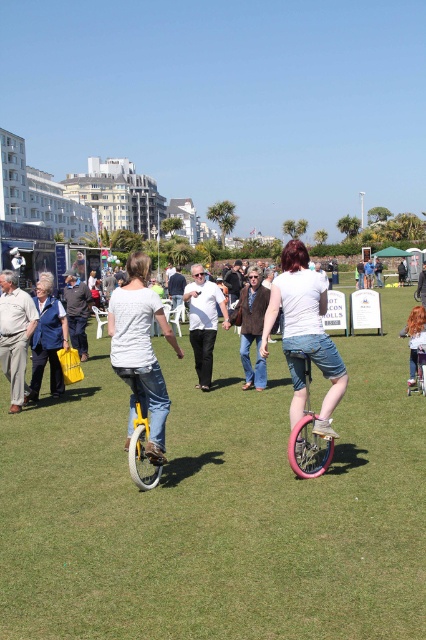
Question: Can you confirm if white matte unicycle at center is thinner than light brown fabric pants at left?

Choices:
 (A) no
 (B) yes

Answer: (A)

Question: Considering the real-world distances, which object is closest to the dark gray sweater at left?

Choices:
 (A) white matte unicycle at center
 (B) light brown fabric pants at left
 (C) blue denim jacket at left

Answer: (C)

Question: Does dark gray sweater at left appear on the left side of blonde hair at center?

Choices:
 (A) no
 (B) yes

Answer: (B)

Question: Which point is closer to the camera?

Choices:
 (A) green grass at center
 (B) blonde hair at center

Answer: (A)

Question: Which point is farther to the camera?

Choices:
 (A) (43, 273)
 (B) (411, 323)

Answer: (A)

Question: Is yellow matte unicycle at left to the left of blue denim jacket at left from the viewer's perspective?

Choices:
 (A) no
 (B) yes

Answer: (A)